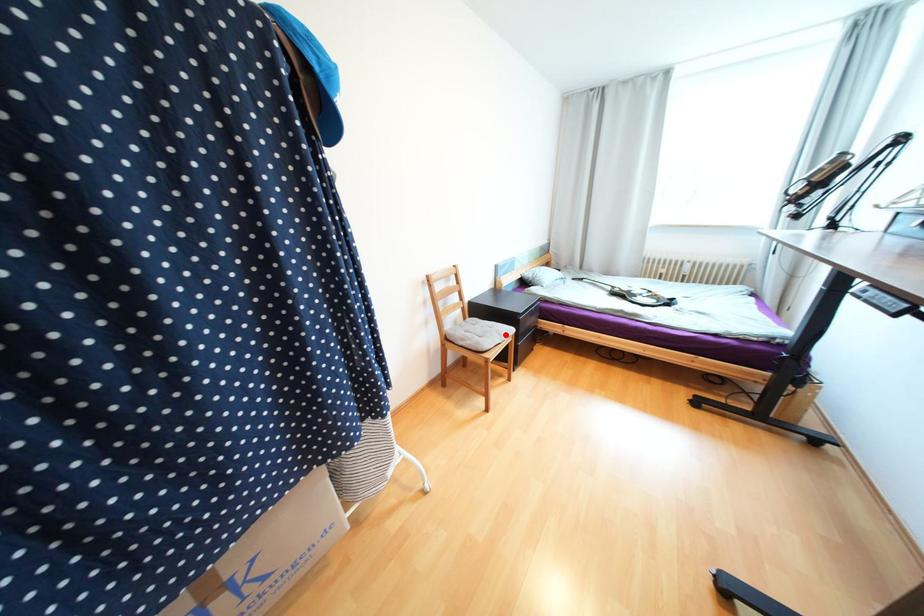
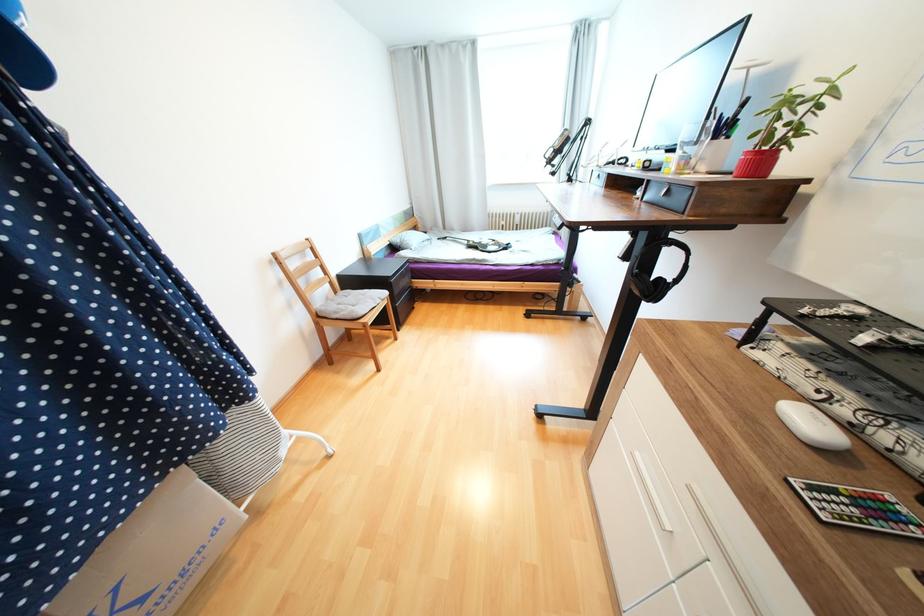
Where in the second image is the point corresponding to the highlighted location from the first image?

(379, 300)